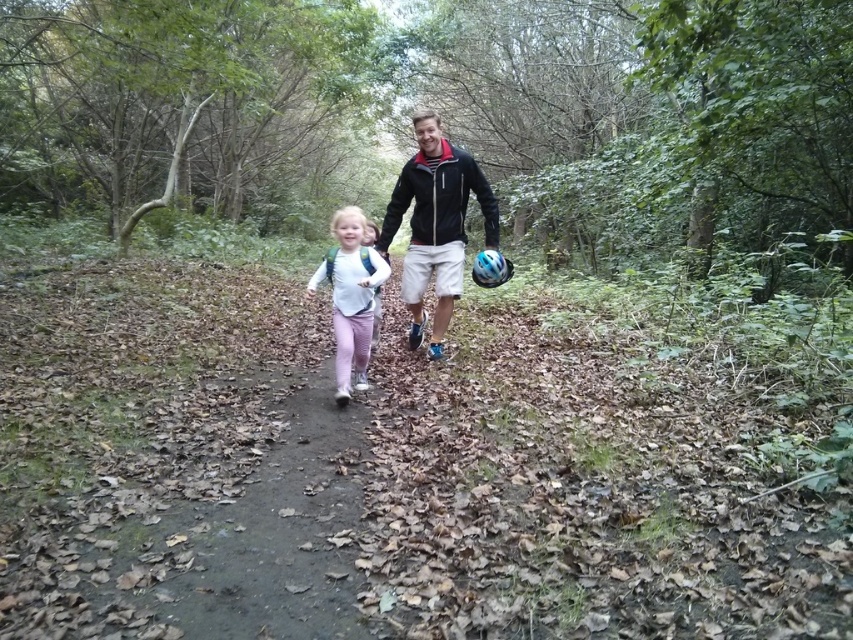
Is point (843, 184) farther from viewer compared to point (347, 344)?

Yes, it is.

Is green matte forest at center shorter than white matte shirt at center?

No, green matte forest at center is not shorter than white matte shirt at center.

Is point (769, 186) behind point (366, 323)?

Yes, it is behind point (366, 323).

Where is `green matte forest at center`? green matte forest at center is located at coordinates (432, 106).